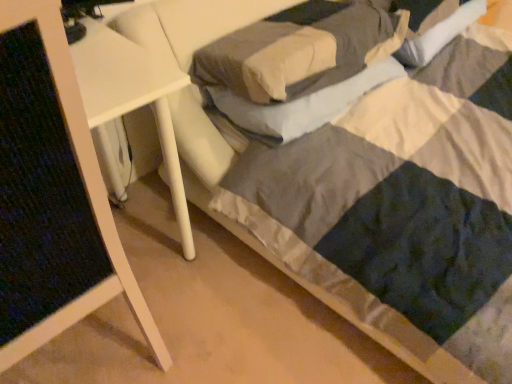
Question: Is soft white pillow at center, the 2th pillow in the top-to-bottom sequence, next to white glossy side table at upper left and touching it?

Choices:
 (A) no
 (B) yes

Answer: (A)

Question: Is soft white pillow at center, the 1th pillow positioned from the bottom, at the right side of white glossy side table at upper left?

Choices:
 (A) yes
 (B) no

Answer: (A)

Question: Can you confirm if soft white pillow at center, the 2th pillow in the top-to-bottom sequence, is shorter than white glossy side table at upper left?

Choices:
 (A) yes
 (B) no

Answer: (A)

Question: Considering the relative sizes of soft white pillow at center, the 2th pillow in the top-to-bottom sequence, and white glossy side table at upper left in the image provided, is soft white pillow at center, the 2th pillow in the top-to-bottom sequence, thinner than white glossy side table at upper left?

Choices:
 (A) yes
 (B) no

Answer: (A)

Question: Is soft white pillow at center, the 1th pillow positioned from the bottom, not inside white glossy side table at upper left?

Choices:
 (A) no
 (B) yes

Answer: (B)

Question: Is the position of soft white pillow at center, the 2th pillow in the top-to-bottom sequence, less distant than that of white glossy side table at upper left?

Choices:
 (A) no
 (B) yes

Answer: (A)

Question: From a real-world perspective, is soft white pillow at center, the 2th pillow in the top-to-bottom sequence, under soft gray pillow at center, acting as the 2th pillow starting from the bottom?

Choices:
 (A) no
 (B) yes

Answer: (B)

Question: Is the position of soft white pillow at center, the 2th pillow in the top-to-bottom sequence, less distant than that of soft gray pillow at center, arranged as the 1th pillow when viewed from the top?

Choices:
 (A) yes
 (B) no

Answer: (B)

Question: Is soft white pillow at center, the 1th pillow positioned from the bottom, aimed at soft gray pillow at center, arranged as the 1th pillow when viewed from the top?

Choices:
 (A) no
 (B) yes

Answer: (A)

Question: Can you confirm if soft white pillow at center, the 2th pillow in the top-to-bottom sequence, is positioned to the right of soft gray pillow at center, arranged as the 1th pillow when viewed from the top?

Choices:
 (A) no
 (B) yes

Answer: (B)

Question: Is soft white pillow at center, the 2th pillow in the top-to-bottom sequence, directly adjacent to soft gray pillow at center, arranged as the 1th pillow when viewed from the top?

Choices:
 (A) no
 (B) yes

Answer: (A)

Question: From a real-world perspective, is soft white pillow at center, the 2th pillow in the top-to-bottom sequence, located higher than soft gray pillow at center, acting as the 2th pillow starting from the bottom?

Choices:
 (A) no
 (B) yes

Answer: (A)

Question: Considering the relative sizes of soft gray pillow at center, arranged as the 1th pillow when viewed from the top, and white glossy side table at upper left in the image provided, is soft gray pillow at center, arranged as the 1th pillow when viewed from the top, shorter than white glossy side table at upper left?

Choices:
 (A) yes
 (B) no

Answer: (A)